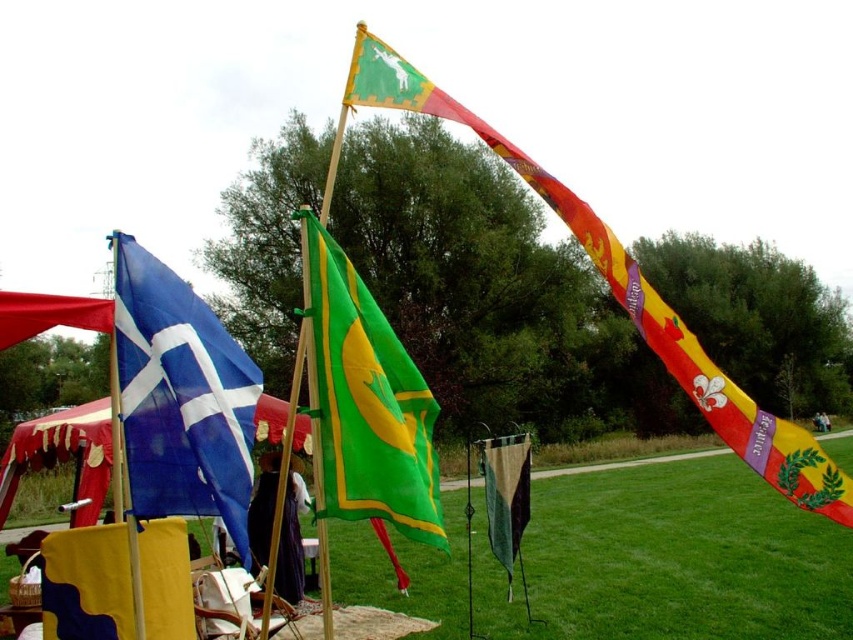
Can you confirm if blue fabric flag at left is positioned to the right of camouflage fabric flag at center?

In fact, blue fabric flag at left is to the left of camouflage fabric flag at center.

Which is more to the left, blue fabric flag at left or camouflage fabric flag at center?

blue fabric flag at left

The height and width of the screenshot is (640, 853). Find the location of `blue fabric flag at left`. blue fabric flag at left is located at coordinates (181, 397).

The image size is (853, 640). Identify the location of blue fabric flag at left. (181, 397).

Which is more to the right, blue fabric flag at left or green matte flag at center?

green matte flag at center

Between point (234, 385) and point (427, 436), which one is positioned behind?

Positioned behind is point (427, 436).

Find the location of a particular element. blue fabric flag at left is located at coordinates (181, 397).

Between green matte flag at center and camouflage fabric flag at lower left, which one has less height?

camouflage fabric flag at lower left

Can you confirm if green matte flag at center is taller than camouflage fabric flag at lower left?

Yes, green matte flag at center is taller than camouflage fabric flag at lower left.

Is point (341, 394) less distant than point (71, 544)?

Yes.

You are a GUI agent. You are given a task and a screenshot of the screen. Output one action in this format:
    pyautogui.click(x=<x>, y=<y>)
    Task: Click on the green matte flag at center
    The image size is (853, 640).
    Given the screenshot: What is the action you would take?
    pyautogui.click(x=367, y=403)